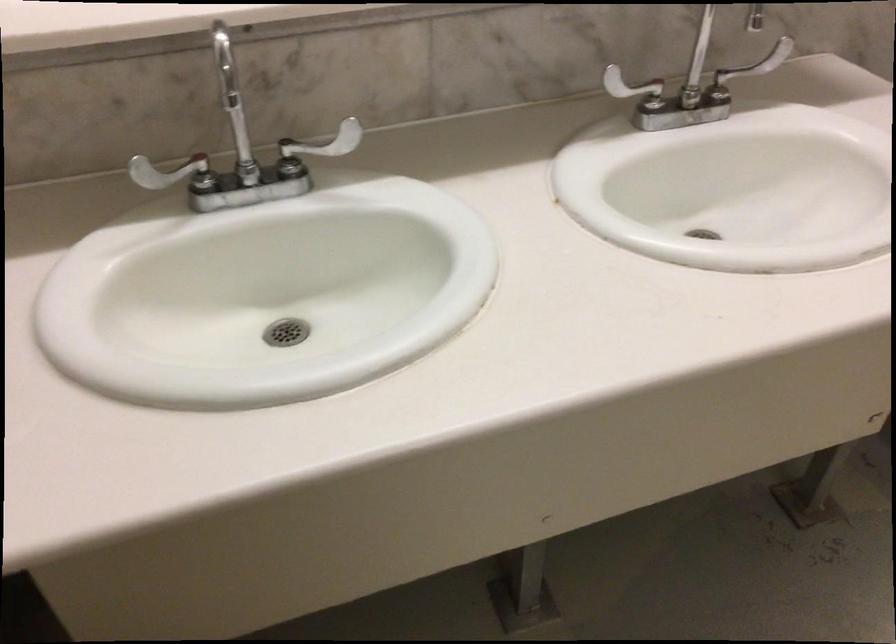
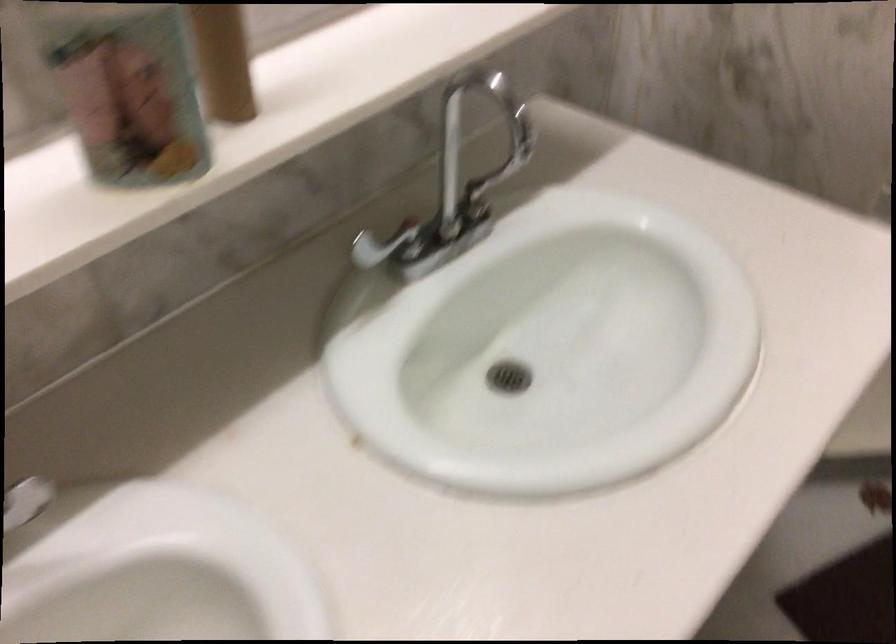
Question: Which direction would the cameraman need to move to produce the second image? Reply with the corresponding letter.

Choices:
 (A) Left
 (B) Right
 (C) Forward
 (D) Backward

Answer: (C)